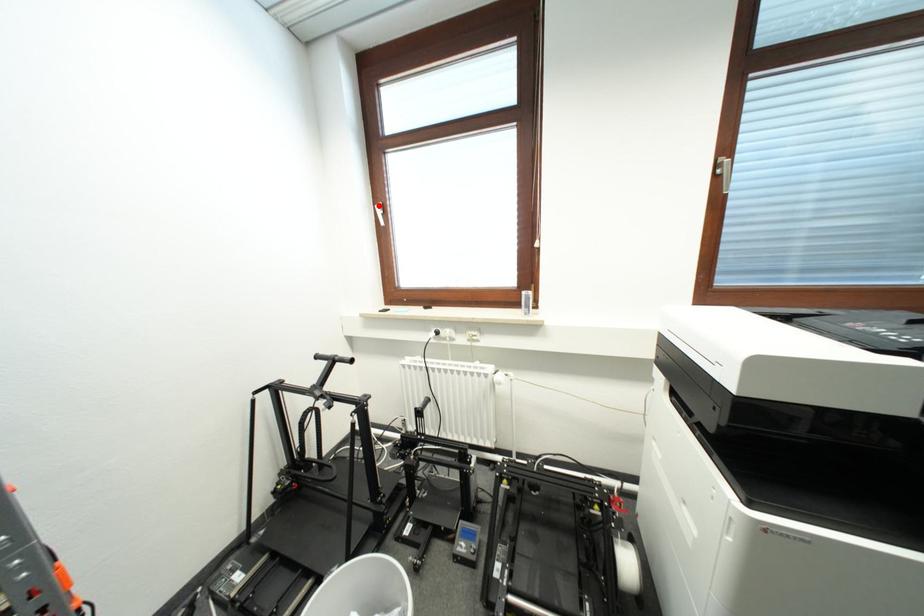
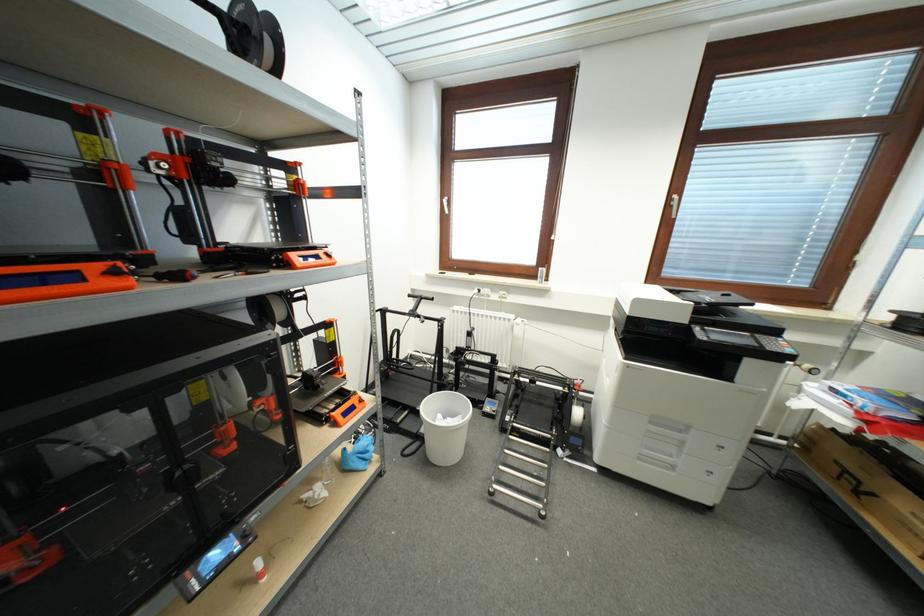
Question: I am providing you with two images of the same scene from different viewpoints. A red point is marked on the first image. Can you still see the location of the red point in image 2?

Choices:
 (A) Yes
 (B) No

Answer: (A)